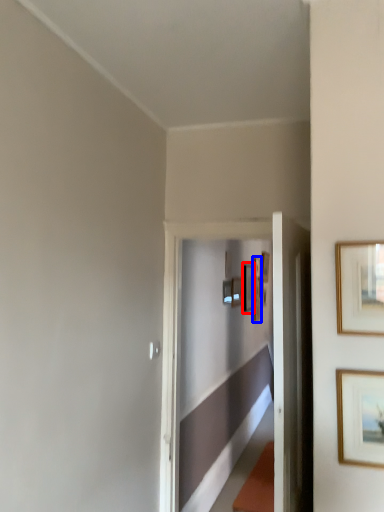
Question: Which of the following is the closest to the observer, picture frame (highlighted by a red box) or picture frame (highlighted by a blue box)?

Choices:
 (A) picture frame
 (B) picture frame

Answer: (A)